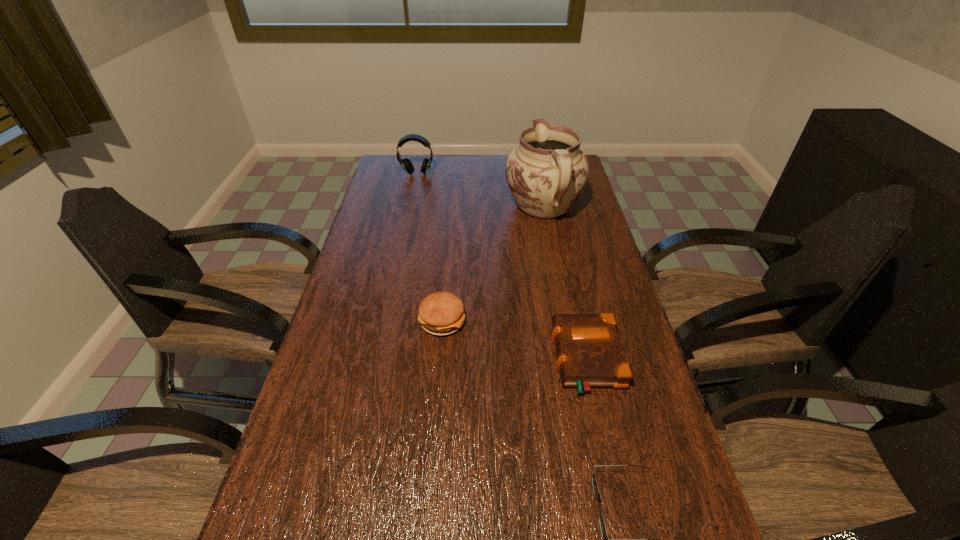
At what (x,y) coordinates should I click in order to perform the action: click on pitcher. Please return your answer as a coordinate pair (x, y). The height and width of the screenshot is (540, 960). Looking at the image, I should click on (546, 173).

The image size is (960, 540). Find the location of `the second farthest object`. the second farthest object is located at coordinates (546, 173).

I want to click on earphone, so click(407, 165).

This screenshot has width=960, height=540. Identify the location of the leftmost object. (407, 165).

Where is `the third shortest object`? The image size is (960, 540). the third shortest object is located at coordinates (441, 313).

Locate an element on the screen. hamburger is located at coordinates (441, 313).

Identify the location of Bible. The height and width of the screenshot is (540, 960). (589, 351).

Where is `vacant region located 0.070m on the spout of the tallest object`? vacant region located 0.070m on the spout of the tallest object is located at coordinates (537, 174).

In order to click on vacant space located 0.210m on the spout of the tallest object in this screenshot , I will do `click(534, 158)`.

You are a GUI agent. You are given a task and a screenshot of the screen. Output one action in this format:
    pyautogui.click(x=<x>, y=<y>)
    Task: Click on the blank area located 0.220m on the spout of the tallest object
    
    Given the screenshot: What is the action you would take?
    pyautogui.click(x=534, y=157)